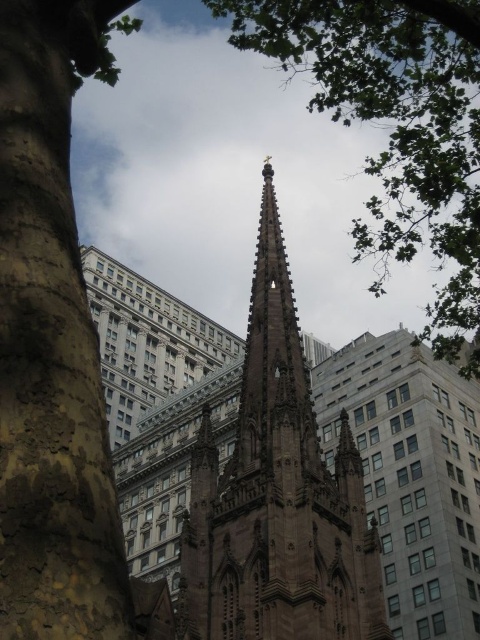
Question: Among these objects, which one is nearest to the camera?

Choices:
 (A) brown rough bark at left
 (B) green leafy tree at upper center
 (C) brown stone spire at center

Answer: (A)

Question: Considering the real-world distances, which object is farthest from the brown stone spire at center?

Choices:
 (A) green leafy tree at upper center
 (B) brown rough bark at left

Answer: (A)

Question: Does brown rough bark at left have a smaller size compared to brown stone spire at center?

Choices:
 (A) no
 (B) yes

Answer: (B)

Question: In this image, where is brown stone spire at center located relative to green leafy tree at upper center?

Choices:
 (A) right
 (B) left

Answer: (B)

Question: Is brown stone spire at center smaller than green leafy tree at upper center?

Choices:
 (A) no
 (B) yes

Answer: (B)

Question: Which point is closer to the camera taking this photo?

Choices:
 (A) (68, 282)
 (B) (264, 616)

Answer: (A)